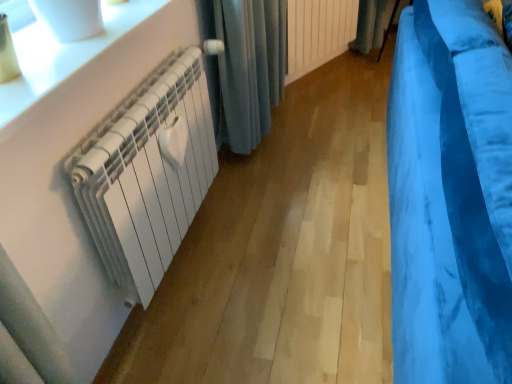
Question: Which direction should I rotate to face white matte radiator at center, the 1th radiator viewed from the top, — up or down?

Choices:
 (A) up
 (B) down

Answer: (A)

Question: Does velvet blue curtain at right, which appears as the first curtain when ordered from the bottom, turn towards blue velvet curtain at upper right, which is the second curtain in front-to-back order?

Choices:
 (A) no
 (B) yes

Answer: (A)

Question: Is velvet blue curtain at right, marked as the second curtain in a top-to-bottom arrangement, smaller than blue velvet curtain at upper right, positioned as the 1th curtain in top-to-bottom order?

Choices:
 (A) no
 (B) yes

Answer: (A)

Question: Can you confirm if velvet blue curtain at right, acting as the second curtain starting from the back, is positioned to the right of blue velvet curtain at upper right, the second curtain in the bottom-to-top sequence?

Choices:
 (A) no
 (B) yes

Answer: (A)

Question: Is velvet blue curtain at right, acting as the second curtain starting from the back, shorter than blue velvet curtain at upper right, acting as the first curtain starting from the back?

Choices:
 (A) yes
 (B) no

Answer: (B)

Question: Is velvet blue curtain at right, marked as the second curtain in a top-to-bottom arrangement, turned away from blue velvet curtain at upper right, positioned as the 1th curtain in top-to-bottom order?

Choices:
 (A) yes
 (B) no

Answer: (B)

Question: Is velvet blue curtain at right, acting as the second curtain starting from the back, wider than blue velvet curtain at upper right, acting as the first curtain starting from the back?

Choices:
 (A) no
 (B) yes

Answer: (B)

Question: From a real-world perspective, is blue velvet curtain at upper right, positioned as the 1th curtain in top-to-bottom order, physically below velvet blue curtain at right, marked as the second curtain in a top-to-bottom arrangement?

Choices:
 (A) no
 (B) yes

Answer: (B)

Question: Considering the relative sizes of blue velvet curtain at upper right, positioned as the 1th curtain in top-to-bottom order, and velvet blue curtain at right, acting as the second curtain starting from the back, in the image provided, is blue velvet curtain at upper right, positioned as the 1th curtain in top-to-bottom order, wider than velvet blue curtain at right, acting as the second curtain starting from the back,?

Choices:
 (A) yes
 (B) no

Answer: (B)

Question: From a real-world perspective, is blue velvet curtain at upper right, the second curtain in the bottom-to-top sequence, physically above velvet blue curtain at right, acting as the second curtain starting from the back?

Choices:
 (A) yes
 (B) no

Answer: (B)

Question: Is velvet blue curtain at right, acting as the second curtain starting from the back, inside blue velvet curtain at upper right, positioned as the 1th curtain in top-to-bottom order?

Choices:
 (A) yes
 (B) no

Answer: (B)

Question: Is blue velvet curtain at upper right, acting as the first curtain starting from the back, thinner than velvet blue curtain at right, which appears as the first curtain when ordered from the bottom?

Choices:
 (A) yes
 (B) no

Answer: (A)

Question: Considering the relative positions of blue velvet curtain at upper right, acting as the first curtain starting from the back, and velvet blue curtain at right, which appears as the first curtain when ordered from the bottom, in the image provided, is blue velvet curtain at upper right, acting as the first curtain starting from the back, behind velvet blue curtain at right, which appears as the first curtain when ordered from the bottom,?

Choices:
 (A) no
 (B) yes

Answer: (B)

Question: Is white glossy radiator at upper left further to the viewer compared to white matte radiator at center, the second radiator ordered from the bottom?

Choices:
 (A) no
 (B) yes

Answer: (A)